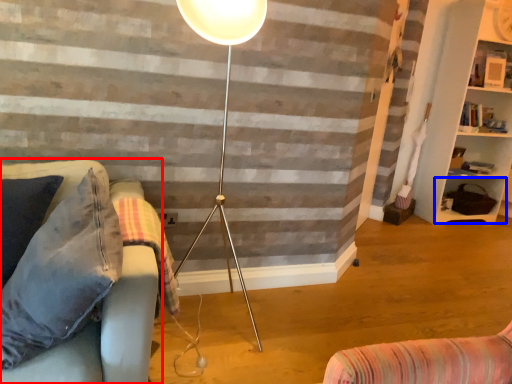
Question: Which of the following is the farthest to the observer, studio couch (highlighted by a red box) or shelf (highlighted by a blue box)?

Choices:
 (A) studio couch
 (B) shelf

Answer: (B)